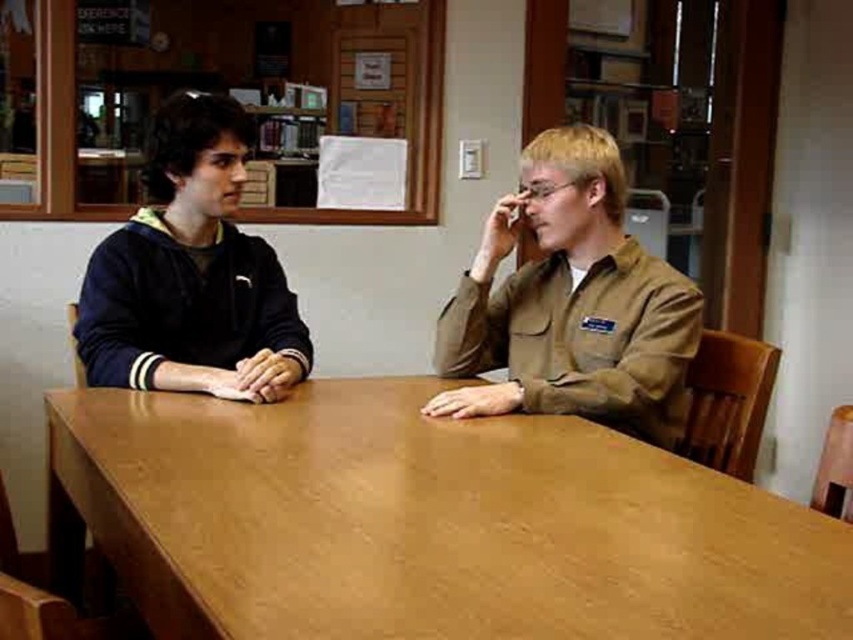
Question: Is brown cotton shirt at right smaller than dark blue fleece at left?

Choices:
 (A) no
 (B) yes

Answer: (A)

Question: Is brown wood table at center further to camera compared to dark blue fleece at left?

Choices:
 (A) yes
 (B) no

Answer: (B)

Question: Which object is farther from the camera taking this photo?

Choices:
 (A) brown wood table at center
 (B) dark blue fleece at left

Answer: (B)

Question: Based on their relative distances, which object is nearer to the dark blue fleece at left?

Choices:
 (A) brown cotton shirt at right
 (B) brown wood table at center

Answer: (B)

Question: Does brown cotton shirt at right have a greater width compared to dark blue fleece at left?

Choices:
 (A) yes
 (B) no

Answer: (A)

Question: Which point appears closest to the camera in this image?

Choices:
 (A) (618, 358)
 (B) (274, 260)
 (C) (607, 544)

Answer: (C)